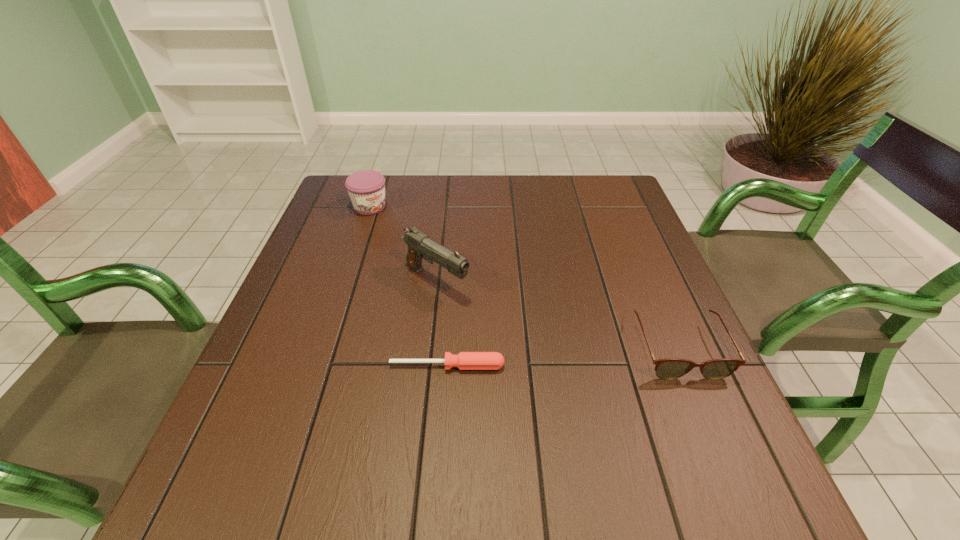
Image resolution: width=960 pixels, height=540 pixels. In order to click on free space between the screwdriver and the gun in this screenshot , I will do `click(442, 323)`.

Locate an element on the screen. free space between the leftmost object and the third tallest object is located at coordinates (524, 278).

Identify the location of empty space that is in between the third tallest object and the screwdriver. (563, 357).

The height and width of the screenshot is (540, 960). Find the location of `vacant area that lies between the screwdriver and the spectacles`. vacant area that lies between the screwdriver and the spectacles is located at coordinates (563, 357).

Where is `the second closest object to the second farthest object`? Image resolution: width=960 pixels, height=540 pixels. the second closest object to the second farthest object is located at coordinates pos(366,188).

Choose which object is the third nearest neighbor to the tallest object. Please provide its 2D coordinates. Your answer should be formatted as a tuple, i.e. [(x, y)], where the tuple contains the x and y coordinates of a point satisfying the conditions above.

[(670, 368)]